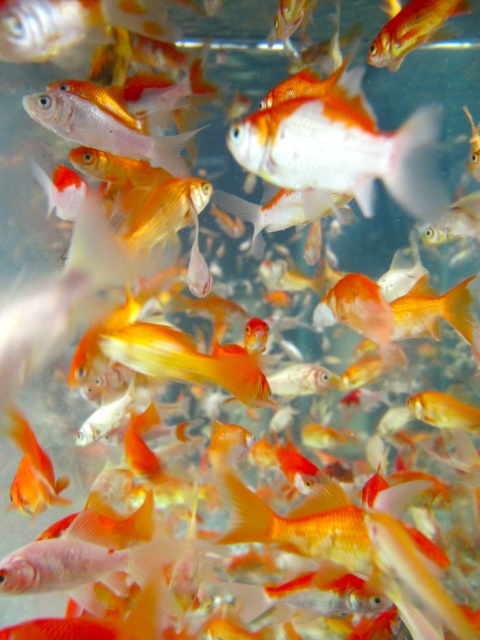
You are a marine biologist observing an underwater scene. You notice a point marked at coordinates (343, 150). What is the significance of this point in the scene?

The point at (343, 150) marks the location of a shiny orange fish at center.

You are a new goldfish in the tank and want to swim to the shiny orange goldfish at upper right. Which direction should you swim to reach it from the shiny orange fish at center?

The shiny orange fish at center is below the shiny orange goldfish at upper right, so you should swim upward to reach it.